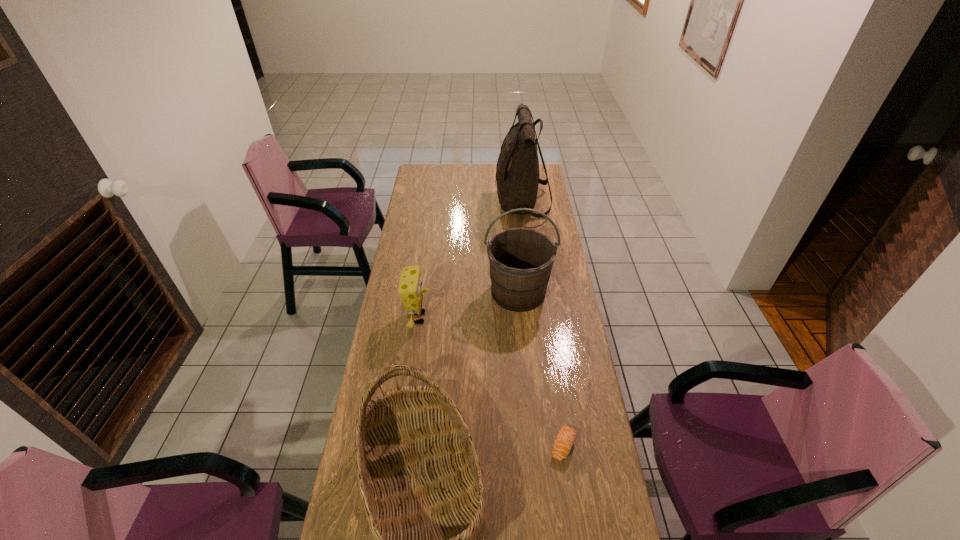
You are a GUI agent. You are given a task and a screenshot of the screen. Output one action in this format:
    pyautogui.click(x=<x>, y=<y>)
    Task: Click on the vacant space situated on the left of the sushi
    This screenshot has width=960, height=540.
    Given the screenshot: What is the action you would take?
    pyautogui.click(x=425, y=446)

This screenshot has width=960, height=540. I want to click on object positioned at the far edge, so click(x=517, y=172).

The image size is (960, 540). I want to click on object that is at the left edge, so click(x=410, y=290).

The image size is (960, 540). What are the coordinates of `backpack located in the right edge section of the desktop` in the screenshot? It's located at (517, 172).

Identify the location of bucket at the right edge. The width and height of the screenshot is (960, 540). (521, 259).

You are a GUI agent. You are given a task and a screenshot of the screen. Output one action in this format:
    pyautogui.click(x=<x>, y=<y>)
    Task: Click on the sushi positioned at the right edge
    This screenshot has height=540, width=960.
    Given the screenshot: What is the action you would take?
    pyautogui.click(x=566, y=436)

The height and width of the screenshot is (540, 960). In order to click on object at the far right corner in this screenshot , I will do `click(517, 172)`.

Find the location of a particular element. The height and width of the screenshot is (540, 960). free space at the far edge is located at coordinates (494, 170).

Image resolution: width=960 pixels, height=540 pixels. Find the location of `free point at the left edge`. free point at the left edge is located at coordinates (421, 332).

The height and width of the screenshot is (540, 960). I want to click on free region at the right edge, so click(x=562, y=359).